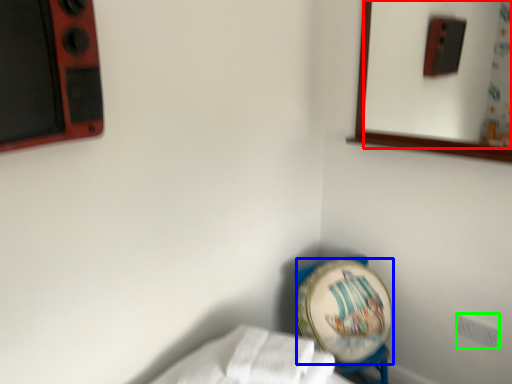
Question: Considering the real-world distances, which object is farthest from mirror (highlighted by a red box)? platter (highlighted by a blue box) or electric outlet (highlighted by a green box)?

Choices:
 (A) platter
 (B) electric outlet

Answer: (B)